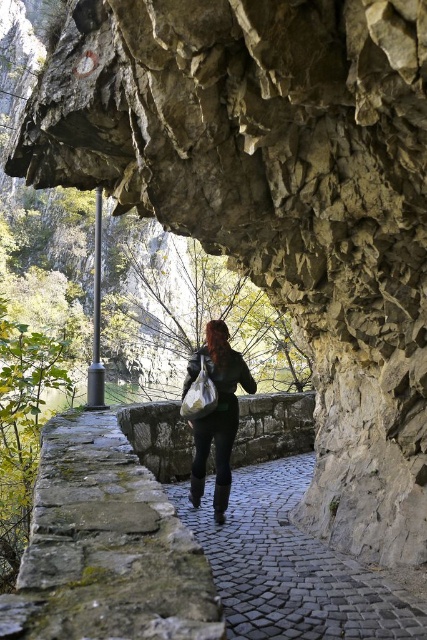
Between point (290, 564) and point (198, 396), which one is positioned in front?

Point (290, 564)

The height and width of the screenshot is (640, 427). Describe the element at coordinates (294, 566) in the screenshot. I see `black cobblestone path at center` at that location.

Locate an element on the screen. black cobblestone path at center is located at coordinates (294, 566).

From the picture: Measure the distance between matte black jacket at center and camera.

matte black jacket at center and camera are 17.39 feet apart from each other.

Which of these two, matte black jacket at center or matte white plastic bag at center, stands taller?

Standing taller between the two is matte black jacket at center.

Identify the location of matte black jacket at center. (216, 413).

Between black cobblestone path at center and matte black jacket at center, which one is positioned lower?

black cobblestone path at center is lower down.

The image size is (427, 640). What do you see at coordinates (294, 566) in the screenshot?
I see `black cobblestone path at center` at bounding box center [294, 566].

Based on the photo, measure the distance between point (290, 486) and camera.

24.07 feet

Find the location of a particular element. This screenshot has width=427, height=640. black cobblestone path at center is located at coordinates tap(294, 566).